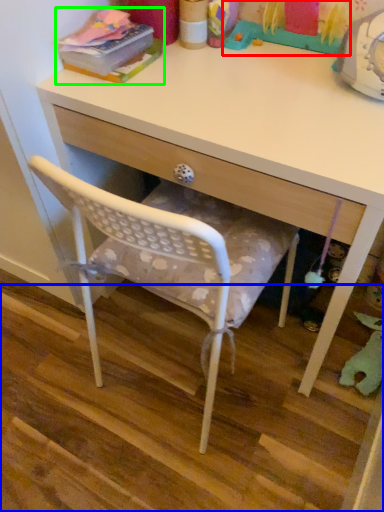
Question: Which is nearer to the toy (highlighted by a red box)? stair (highlighted by a blue box) or book (highlighted by a green box).

Choices:
 (A) stair
 (B) book

Answer: (B)